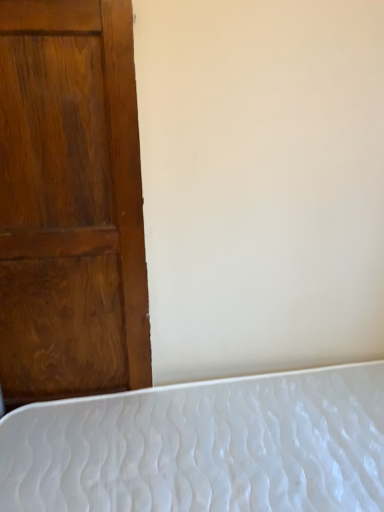
This screenshot has height=512, width=384. What do you see at coordinates (70, 201) in the screenshot?
I see `shiny brown wood door at left` at bounding box center [70, 201].

Find the location of a particular element. This screenshot has width=384, height=512. shiny brown wood door at left is located at coordinates (70, 201).

What is the approximate width of white textured mattress at lower left?

It is 1.47 meters.

In order to click on white textured mattress at lower left in this screenshot , I will do `click(204, 447)`.

Describe the element at coordinates (204, 447) in the screenshot. The image size is (384, 512). I see `white textured mattress at lower left` at that location.

Locate an element on the screen. The height and width of the screenshot is (512, 384). shiny brown wood door at left is located at coordinates (70, 201).

Between shiny brown wood door at left and white textured mattress at lower left, which one appears on the right side from the viewer's perspective?

white textured mattress at lower left.

Considering the positions of objects shiny brown wood door at left and white textured mattress at lower left in the image provided, who is behind, shiny brown wood door at left or white textured mattress at lower left?

shiny brown wood door at left is further from the camera.

Which is closer to the camera, (x=34, y=50) or (x=217, y=470)?

The point (x=34, y=50) is closer.

From the image's perspective, between shiny brown wood door at left and white textured mattress at lower left, who is located below?

From the image's view, white textured mattress at lower left is below.

From a real-world perspective, which object rests below the other?

white textured mattress at lower left.

Which of these two, shiny brown wood door at left or white textured mattress at lower left, is wider?

white textured mattress at lower left is wider.

Who is shorter, shiny brown wood door at left or white textured mattress at lower left?

With less height is white textured mattress at lower left.

Is shiny brown wood door at left smaller than white textured mattress at lower left?

Correct, shiny brown wood door at left occupies less space than white textured mattress at lower left.

Is shiny brown wood door at left completely or partially outside of white textured mattress at lower left?

That's correct, shiny brown wood door at left is outside of white textured mattress at lower left.

Is shiny brown wood door at left positioned far away from white textured mattress at lower left?

No, there isn't a large distance between shiny brown wood door at left and white textured mattress at lower left.

Is shiny brown wood door at left facing away from white textured mattress at lower left?

That's not correct — shiny brown wood door at left is not looking away from white textured mattress at lower left.

Measure the distance between shiny brown wood door at left and white textured mattress at lower left.

shiny brown wood door at left and white textured mattress at lower left are 47.67 centimeters apart.

The image size is (384, 512). I want to click on bed below the shiny brown wood door at left (from the image's perspective), so click(x=204, y=447).

Is white textured mattress at lower left at the right side of shiny brown wood door at left?

Yes, white textured mattress at lower left is to the right of shiny brown wood door at left.

Considering their positions, is white textured mattress at lower left located in front of or behind shiny brown wood door at left?

Clearly, white textured mattress at lower left is in front of shiny brown wood door at left.

Which is less distant, (292, 440) or (0, 87)?

Point (292, 440).

From the image's perspective, which object appears higher, white textured mattress at lower left or shiny brown wood door at left?

shiny brown wood door at left.

From a real-world perspective, is white textured mattress at lower left positioned under shiny brown wood door at left based on gravity?

Yes, from a real-world perspective, white textured mattress at lower left is below shiny brown wood door at left.

Based on the photo, considering the relative sizes of white textured mattress at lower left and shiny brown wood door at left in the image provided, is white textured mattress at lower left thinner than shiny brown wood door at left?

Incorrect, the width of white textured mattress at lower left is not less than that of shiny brown wood door at left.

Who is taller, white textured mattress at lower left or shiny brown wood door at left?

With more height is shiny brown wood door at left.

Between white textured mattress at lower left and shiny brown wood door at left, which one has larger size?

white textured mattress at lower left is bigger.

Does white textured mattress at lower left contain shiny brown wood door at left?

No, shiny brown wood door at left is located outside of white textured mattress at lower left.

Are white textured mattress at lower left and shiny brown wood door at left far apart?

white textured mattress at lower left is near shiny brown wood door at left, not far away.

Could you tell me if white textured mattress at lower left is facing shiny brown wood door at left?

No, white textured mattress at lower left is not aimed at shiny brown wood door at left.

Can you tell me how much white textured mattress at lower left and shiny brown wood door at left differ in facing direction?

The angular difference between white textured mattress at lower left and shiny brown wood door at left is 89.2 degrees.

You are a GUI agent. You are given a task and a screenshot of the screen. Output one action in this format:
    pyautogui.click(x=<x>, y=<y>)
    Task: Click on the bed located in front of the shiny brown wood door at left
    
    Given the screenshot: What is the action you would take?
    pyautogui.click(x=204, y=447)

Image resolution: width=384 pixels, height=512 pixels. Identify the location of door behind the white textured mattress at lower left. (70, 201).

You are a GUI agent. You are given a task and a screenshot of the screen. Output one action in this format:
    pyautogui.click(x=<x>, y=<y>)
    Task: Click on the bed on the right of shiny brown wood door at left
    The height and width of the screenshot is (512, 384).
    Given the screenshot: What is the action you would take?
    pyautogui.click(x=204, y=447)